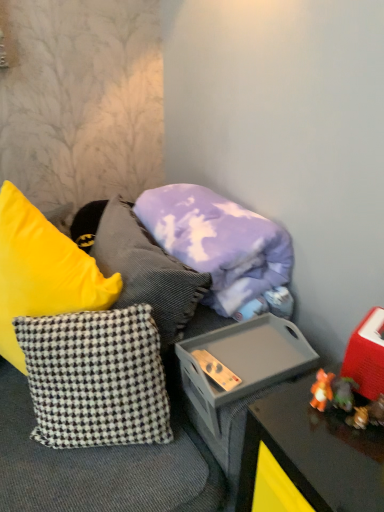
Question: Is point (233, 297) positioned closer to the camera than point (152, 358)?

Choices:
 (A) closer
 (B) farther

Answer: (B)

Question: From a real-world perspective, relative to black and white checkered pillow at center, the 2th pillow positioned from the top, is purple cotton pillow at center, the first pillow positioned from the top, vertically above or below?

Choices:
 (A) below
 (B) above

Answer: (B)

Question: In the image, is purple cotton pillow at center, which ranks as the second pillow in bottom-to-top order, on the left side or the right side of black and white checkered pillow at center, the 2th pillow positioned from the top?

Choices:
 (A) left
 (B) right

Answer: (B)

Question: Does point tap(36, 426) appear closer or farther from the camera than point tap(190, 185)?

Choices:
 (A) farther
 (B) closer

Answer: (B)

Question: From a real-world perspective, is black and white checkered pillow at center, the 2th pillow positioned from the top, positioned above or below purple cotton pillow at center, which ranks as the second pillow in bottom-to-top order?

Choices:
 (A) below
 (B) above

Answer: (A)

Question: Choose the correct answer: Is black and white checkered pillow at center, the 2th pillow positioned from the top, inside purple cotton pillow at center, the first pillow positioned from the top, or outside it?

Choices:
 (A) inside
 (B) outside

Answer: (B)

Question: In terms of width, does black and white checkered pillow at center, the 2th pillow positioned from the top, look wider or thinner when compared to purple cotton pillow at center, the first pillow positioned from the top?

Choices:
 (A) thin
 (B) wide

Answer: (A)